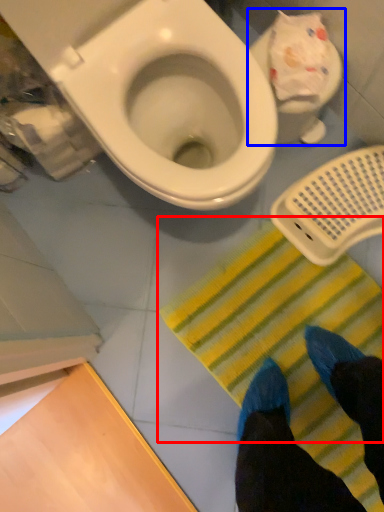
Question: Which of the following is the farthest to the observer, doormat (highlighted by a red box) or toilet (highlighted by a blue box)?

Choices:
 (A) doormat
 (B) toilet

Answer: (A)